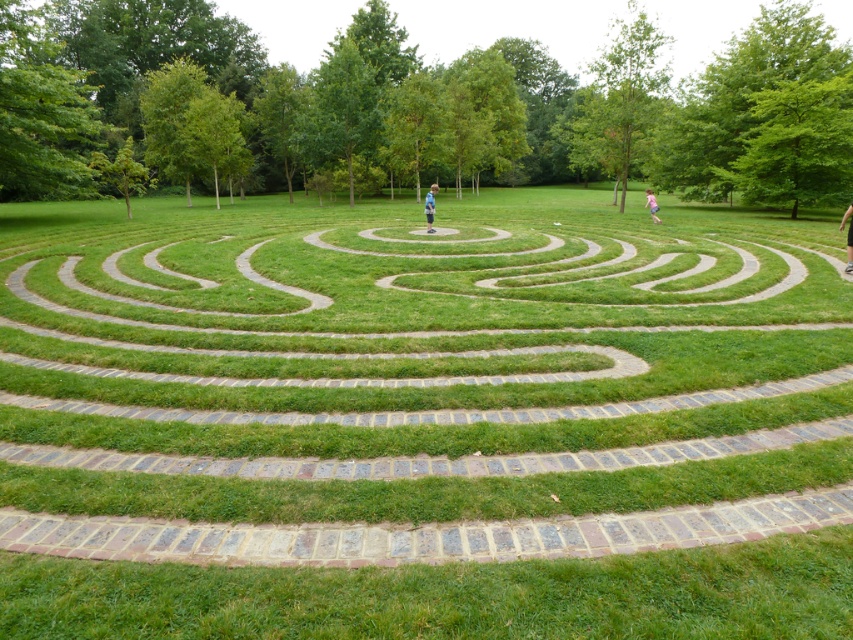
Who is positioned more to the right, dark gray pants at center or blurred white shirt at upper center?

Positioned to the right is dark gray pants at center.

Which is below, dark gray pants at center or blurred white shirt at upper center?

dark gray pants at center

Where is `dark gray pants at center`? The height and width of the screenshot is (640, 853). dark gray pants at center is located at coordinates point(846,237).

Where is `dark gray pants at center`? The image size is (853, 640). dark gray pants at center is located at coordinates (846, 237).

Which of these two, dark gray pants at center or blue denim jeans at center, stands taller?

blue denim jeans at center

Between point (848, 273) and point (428, 205), which one is positioned in front?

Point (848, 273) is in front.

Who is more forward, [850,221] or [431,202]?

Point [850,221] is in front.

Find the location of a particular element. The image size is (853, 640). dark gray pants at center is located at coordinates (846, 237).

Where is `green grass at center`? The image size is (853, 640). green grass at center is located at coordinates (422, 422).

Which is above, green grass at center or blue denim jeans at center?

blue denim jeans at center

Does point (434, 314) come farther from viewer compared to point (431, 204)?

No, (434, 314) is in front of (431, 204).

Locate an element on the screen. green grass at center is located at coordinates (422, 422).